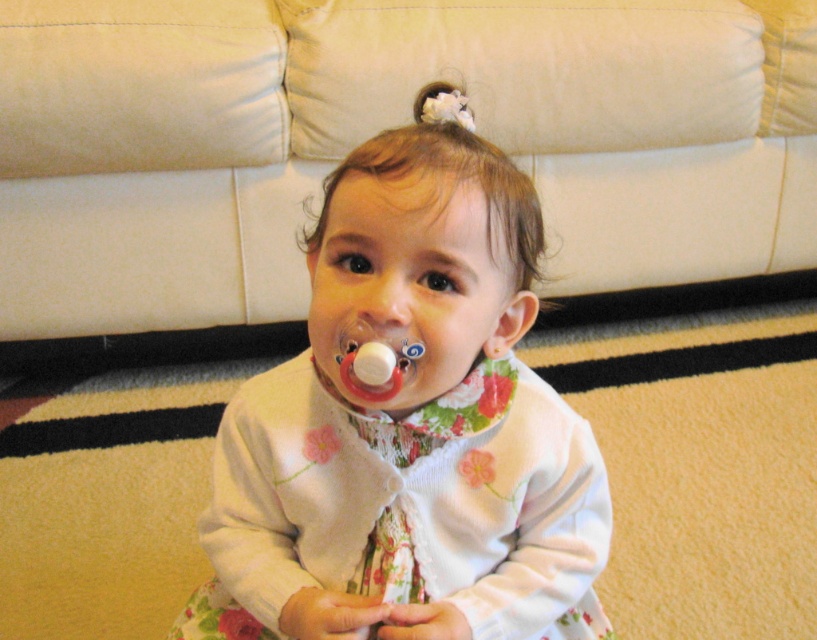
The child in the image is holding two pacifiers. Which one, the smooth white pacifier at center or the rubber pacifier at center, is closer to the viewer?

The smooth white pacifier at center is closer to the viewer because it is in front of the rubber pacifier at center.

You are a photographer setting up a shoot in this room. You need to position a 1.5 meter tall tripod between the white leather couch at upper center and the smooth white pacifier at center. Since the couch is above the pacifier, where should you place the tripod to ensure it stands on the floor?

The white leather couch at upper center is above the smooth white pacifier at center, so the tripod should be placed on the floor near the pacifier since the couch is elevated and not on the floor.